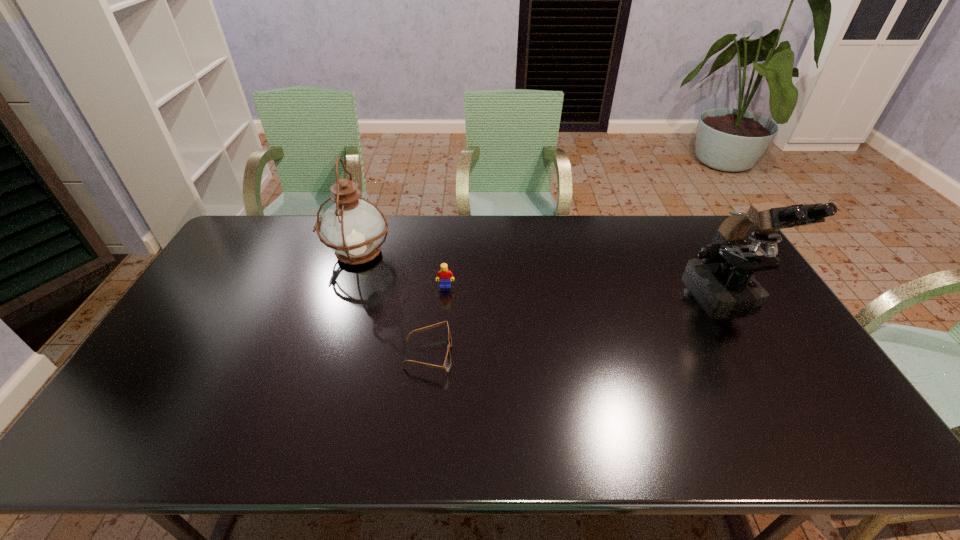
Image resolution: width=960 pixels, height=540 pixels. Identify the location of free location that satisfies the following two spatial constraints: 1. on the face of the Lego; 2. on the frames of the sunglasses. (440, 354).

At what (x,y) coordinates should I click in order to perform the action: click on blank area in the image that satisfies the following two spatial constraints: 1. on the face of the Lego; 2. on the left side of the microscope. Please return your answer as a coordinate pair (x, y). The width and height of the screenshot is (960, 540). Looking at the image, I should click on (445, 292).

This screenshot has width=960, height=540. I want to click on free space that satisfies the following two spatial constraints: 1. on the face of the Lego; 2. on the right side of the microscope, so click(x=445, y=292).

Locate an element on the screen. The height and width of the screenshot is (540, 960). free space that satisfies the following two spatial constraints: 1. on the front side of the microscope; 2. on the left side of the oil lamp is located at coordinates 346,292.

The image size is (960, 540). Find the location of `vacant space that satisfies the following two spatial constraints: 1. on the front side of the microscope; 2. on the frames of the sunglasses`. vacant space that satisfies the following two spatial constraints: 1. on the front side of the microscope; 2. on the frames of the sunglasses is located at coordinates (763, 354).

You are a GUI agent. You are given a task and a screenshot of the screen. Output one action in this format:
    pyautogui.click(x=<x>, y=<y>)
    Task: Click on the vacant space that satisfies the following two spatial constraints: 1. on the face of the Lego; 2. on the frames of the sunglasses
    The width and height of the screenshot is (960, 540).
    Given the screenshot: What is the action you would take?
    pyautogui.click(x=440, y=354)

You are a GUI agent. You are given a task and a screenshot of the screen. Output one action in this format:
    pyautogui.click(x=<x>, y=<y>)
    Task: Click on the vacant position in the image that satisfies the following two spatial constraints: 1. on the face of the Lego; 2. on the frames of the nearest object
    
    Given the screenshot: What is the action you would take?
    pyautogui.click(x=440, y=354)